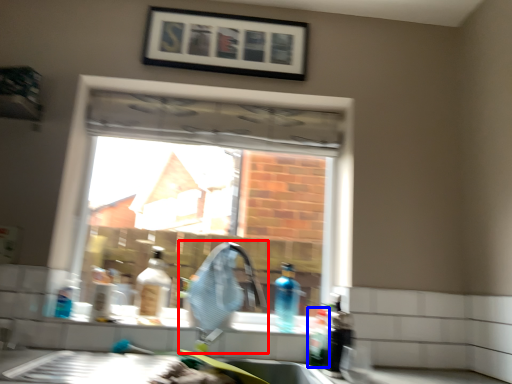
Question: Among these objects, which one is nearest to the camera, faucet (highlighted by a red box) or bottle (highlighted by a blue box)?

Choices:
 (A) faucet
 (B) bottle

Answer: (A)